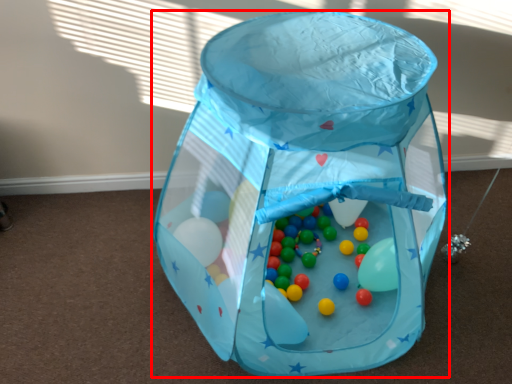
Question: Considering the relative positions of baby carriage (annotated by the red box) and toy in the image provided, where is baby carriage (annotated by the red box) located with respect to the staircase?

Choices:
 (A) right
 (B) left

Answer: (B)